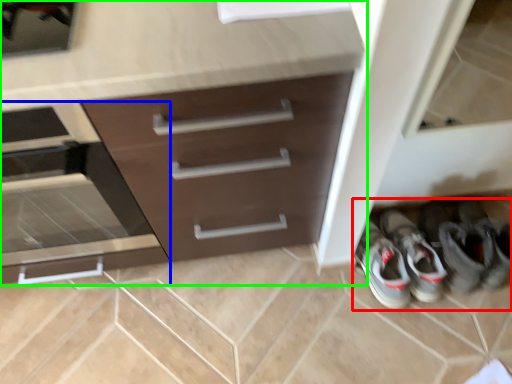
Question: Which object is positioned closest to footwear (highlighted by a red box)? Select from drawer (highlighted by a blue box) and chest of drawers (highlighted by a green box).

Choices:
 (A) drawer
 (B) chest of drawers

Answer: (B)